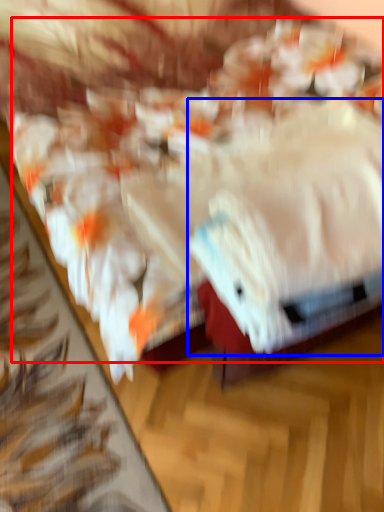
Question: Which object appears farthest to the camera in this image, food (highlighted by a red box) or towel (highlighted by a blue box)?

Choices:
 (A) food
 (B) towel

Answer: (B)